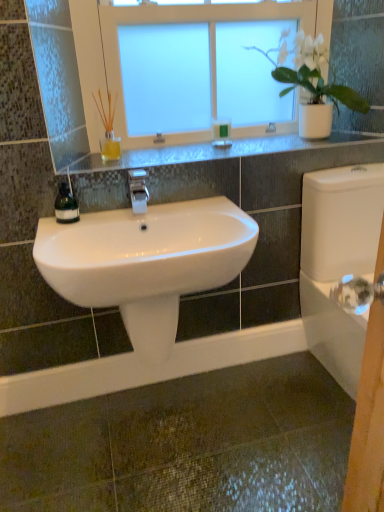
Question: Considering the relative sizes of green matte soap dispenser at left and white frosted glass window at upper center in the image provided, is green matte soap dispenser at left wider than white frosted glass window at upper center?

Choices:
 (A) no
 (B) yes

Answer: (A)

Question: Is green matte soap dispenser at left shorter than white frosted glass window at upper center?

Choices:
 (A) no
 (B) yes

Answer: (B)

Question: Is green matte soap dispenser at left thinner than white frosted glass window at upper center?

Choices:
 (A) no
 (B) yes

Answer: (B)

Question: Is green matte soap dispenser at left positioned behind white frosted glass window at upper center?

Choices:
 (A) yes
 (B) no

Answer: (B)

Question: From a real-world perspective, does green matte soap dispenser at left sit lower than white frosted glass window at upper center?

Choices:
 (A) no
 (B) yes

Answer: (B)

Question: From a real-world perspective, is white glossy sink at center positioned above or below white frosted glass window at upper center?

Choices:
 (A) above
 (B) below

Answer: (B)

Question: Considering their positions, is white glossy sink at center located in front of or behind white frosted glass window at upper center?

Choices:
 (A) behind
 (B) front

Answer: (B)

Question: Does point (56, 251) appear closer or farther from the camera than point (119, 34)?

Choices:
 (A) closer
 (B) farther

Answer: (A)

Question: Considering the relative positions of white glossy sink at center and white frosted glass window at upper center in the image provided, is white glossy sink at center to the left or to the right of white frosted glass window at upper center?

Choices:
 (A) right
 (B) left

Answer: (B)

Question: Visually, is green matte soap at upper center positioned to the left or to the right of white glossy sink at center?

Choices:
 (A) right
 (B) left

Answer: (A)

Question: From a real-world perspective, is green matte soap at upper center physically located above or below white glossy sink at center?

Choices:
 (A) below
 (B) above

Answer: (B)

Question: Is green matte soap at upper center wider or thinner than white glossy sink at center?

Choices:
 (A) thin
 (B) wide

Answer: (A)

Question: Considering their positions, is green matte soap at upper center located in front of or behind white glossy sink at center?

Choices:
 (A) behind
 (B) front

Answer: (A)

Question: From a real-world perspective, is white glossy faucet at center positioned above or below satin silver shelf at upper center?

Choices:
 (A) above
 (B) below

Answer: (B)

Question: In the image, is white glossy faucet at center on the left side or the right side of satin silver shelf at upper center?

Choices:
 (A) left
 (B) right

Answer: (A)